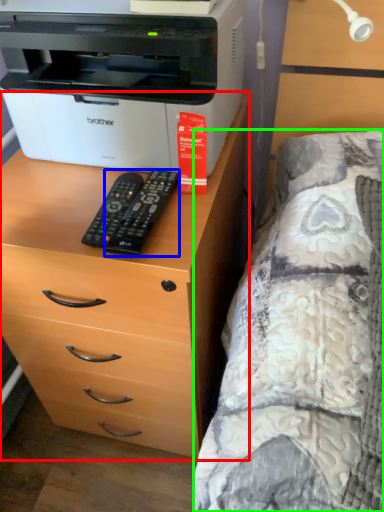
Question: Which object is positioned closest to chest of drawers (highlighted by a red box)? Select from remote (highlighted by a blue box) and bed (highlighted by a green box).

Choices:
 (A) remote
 (B) bed

Answer: (B)